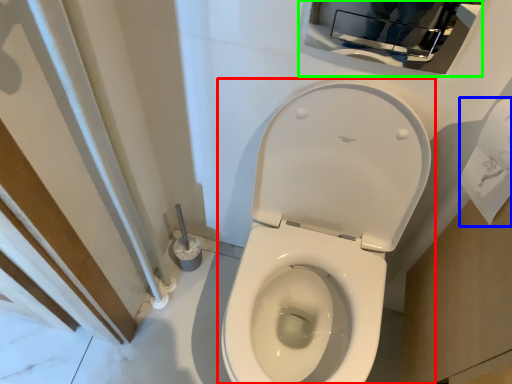
Question: Considering the real-world distances, which object is farthest from toilet (highlighted by a red box)? toilet paper (highlighted by a blue box) or medicine cabinet (highlighted by a green box)?

Choices:
 (A) toilet paper
 (B) medicine cabinet

Answer: (B)